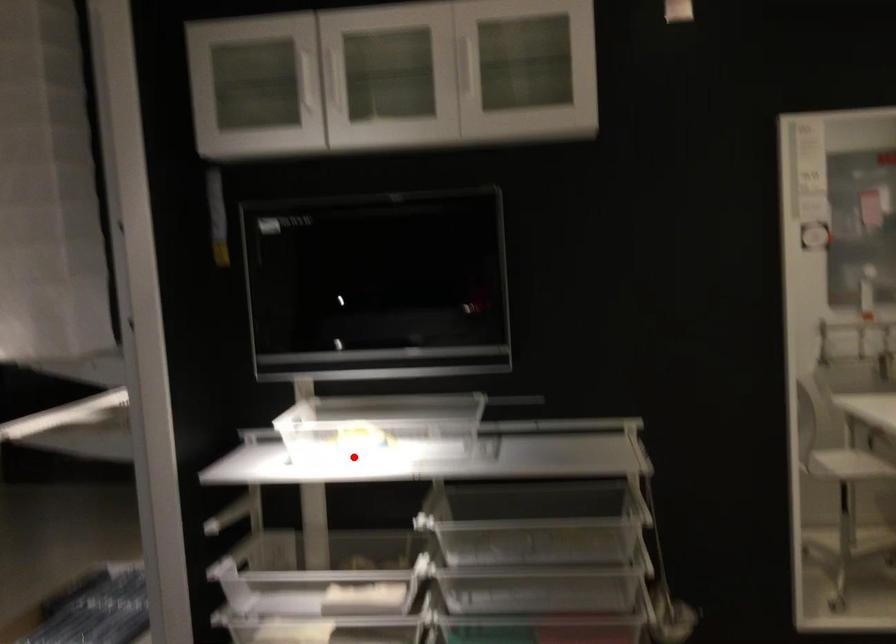
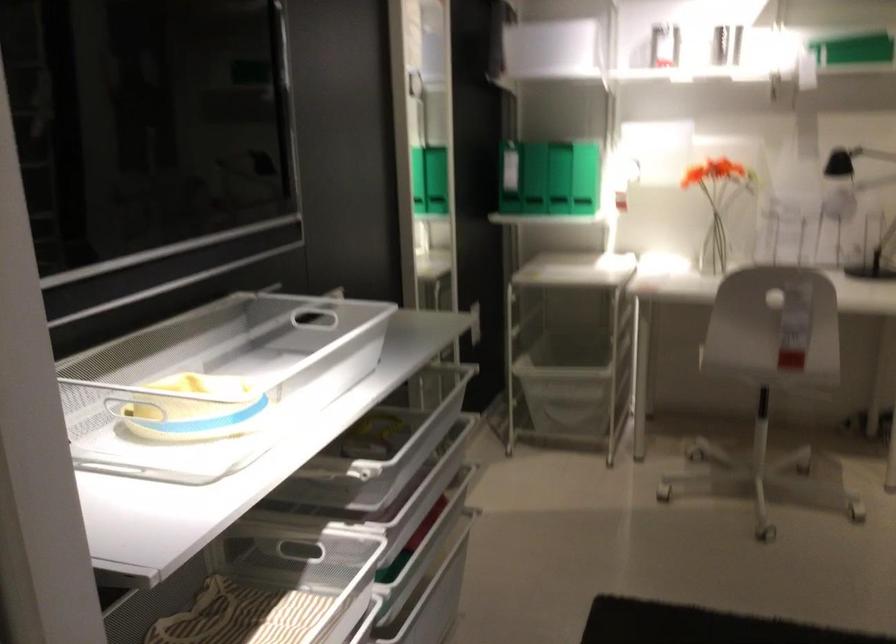
Find the pixel in the second image that matches the highlighted location in the first image.

(216, 383)